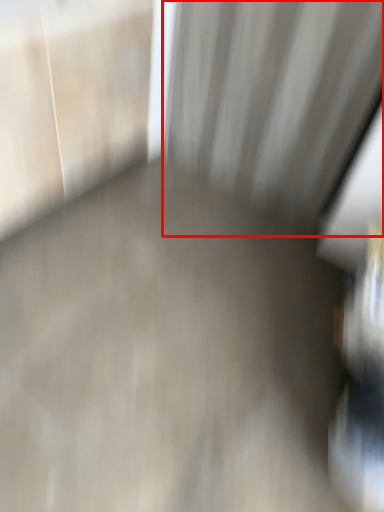
Question: From the image's perspective, considering the relative positions of curtain (annotated by the red box) and concrete in the image provided, where is curtain (annotated by the red box) located with respect to the staircase?

Choices:
 (A) above
 (B) below

Answer: (A)